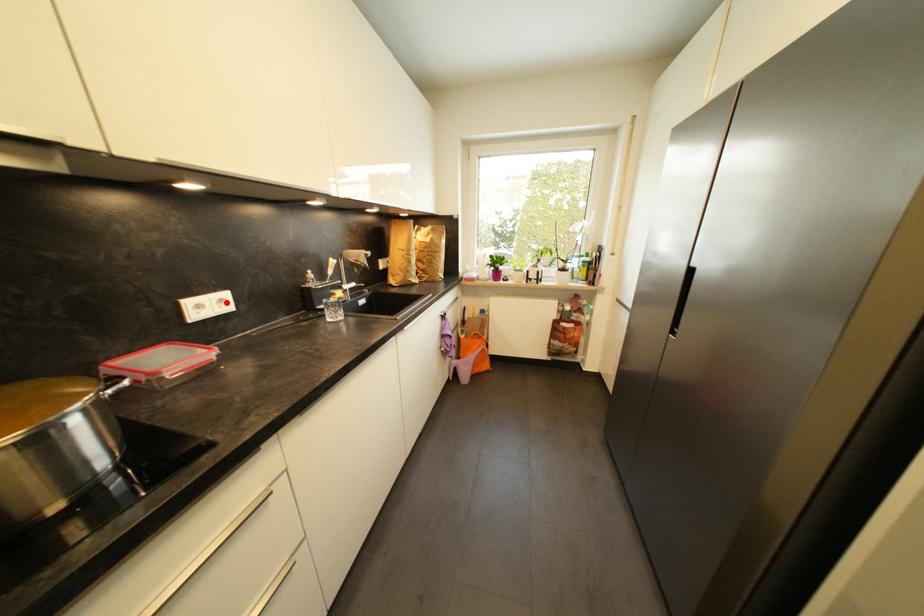
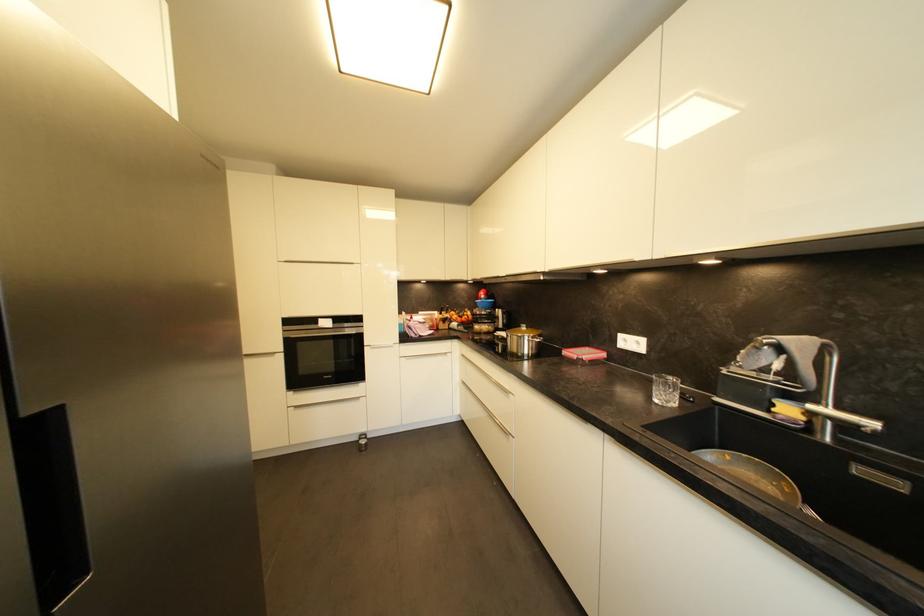
The point at the highlighted location is marked in the first image. Where is the corresponding point in the second image?

(642, 345)